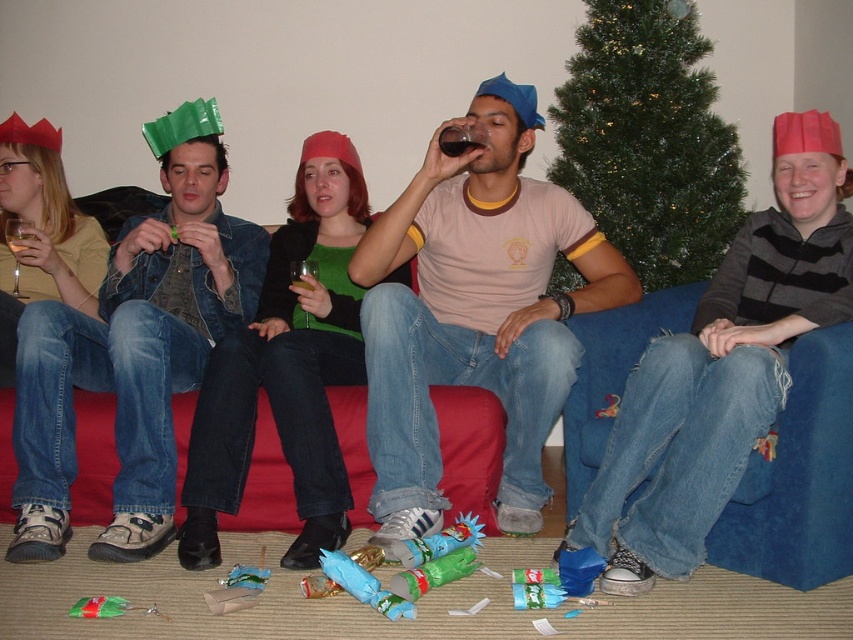
Where is `denim jacket at left`? denim jacket at left is located at coordinates pos(134,348).

Which is in front, point (180, 132) or point (35, 253)?

Point (35, 253) is more forward.

Locate an element on the screen. The image size is (853, 640). denim jacket at left is located at coordinates (134, 348).

Is denim jacket at left positioned at the back of translucent glass at center?

No, denim jacket at left is closer to the viewer.

Who is shorter, denim jacket at left or translucent glass at center?

translucent glass at center is shorter.

Locate an element on the screen. This screenshot has width=853, height=640. denim jacket at left is located at coordinates (134, 348).

Find the location of a particular element. This screenshot has height=640, width=853. denim jacket at left is located at coordinates (134, 348).

Who is positioned more to the left, matte pink t-shirt at center or blue suede couch at lower right?

Positioned to the left is matte pink t-shirt at center.

Between matte pink t-shirt at center and blue suede couch at lower right, which one is positioned higher?

matte pink t-shirt at center is above.

Measure the distance between point (515,499) and camera.

Point (515,499) and camera are 7.89 feet apart from each other.

Image resolution: width=853 pixels, height=640 pixels. What are the coordinates of `matte pink t-shirt at center` in the screenshot? It's located at (474, 310).